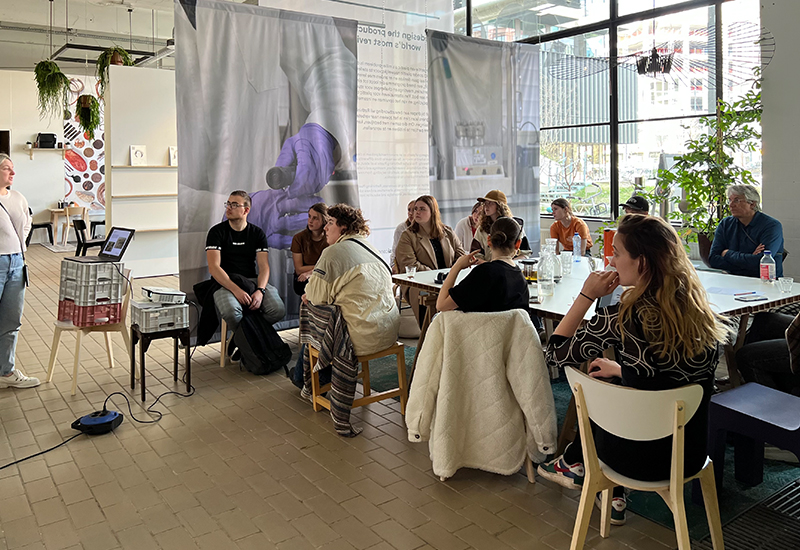
Locate an element on the screen. This screenshot has height=550, width=800. floor is located at coordinates (202, 446).